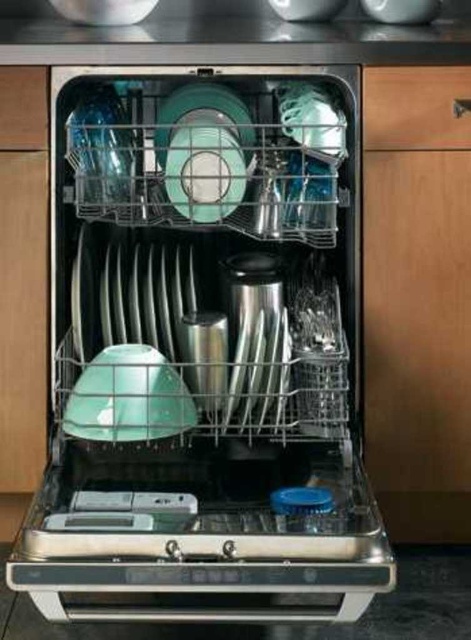
The image size is (471, 640). Find the location of `wooden drawer at right`. wooden drawer at right is located at coordinates (414, 108).

Can you confirm if stainless steel dishwasher at center is positioned to the right of wooden drawer at right?

No, stainless steel dishwasher at center is not to the right of wooden drawer at right.

Who is shorter, stainless steel dishwasher at center or wooden drawer at right?

wooden drawer at right

Does point (146, 403) come behind point (395, 124)?

No.

You are a GUI agent. You are given a task and a screenshot of the screen. Output one action in this format:
    pyautogui.click(x=<x>, y=<y>)
    Task: Click on the stainless steel dishwasher at center
    The width and height of the screenshot is (471, 640).
    Given the screenshot: What is the action you would take?
    pyautogui.click(x=203, y=352)

The image size is (471, 640). What do you see at coordinates (203, 352) in the screenshot?
I see `stainless steel dishwasher at center` at bounding box center [203, 352].

Looking at this image, which of these two, stainless steel dishwasher at center or wooden drawer at left, stands taller?

stainless steel dishwasher at center is taller.

What are the coordinates of `stainless steel dishwasher at center` in the screenshot? It's located at (203, 352).